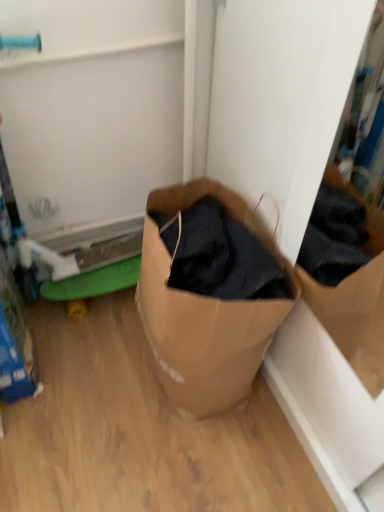
I want to click on vacant area that lies in front of green rubber toy at lower left, so click(x=97, y=356).